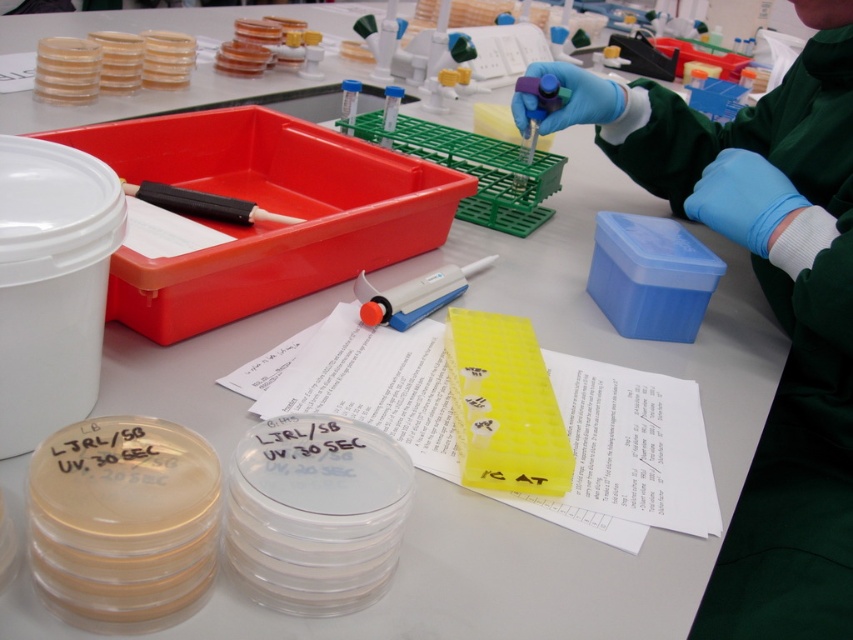
Question: Which object is closer to the camera taking this photo?

Choices:
 (A) white plastic pipette at center
 (B) blue latex glove at upper right

Answer: (B)

Question: Does blue latex glove at upper right have a smaller size compared to white plastic pipette at center?

Choices:
 (A) no
 (B) yes

Answer: (A)

Question: Is blue latex glove at upper right closer to camera compared to white plastic pipette at center?

Choices:
 (A) yes
 (B) no

Answer: (A)

Question: Among these objects, which one is farthest from the camera?

Choices:
 (A) white plastic pipette at center
 (B) blue latex glove at upper right

Answer: (A)

Question: Does blue latex glove at upper right appear on the right side of white plastic pipette at center?

Choices:
 (A) no
 (B) yes

Answer: (B)